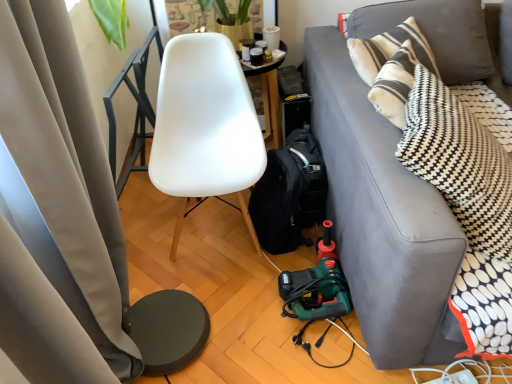
Question: Does black fabric backpack at lower center have a greater width compared to white plastic power outlet at lower right?

Choices:
 (A) no
 (B) yes

Answer: (B)

Question: From the image's perspective, is black fabric backpack at lower center above white plastic power outlet at lower right?

Choices:
 (A) yes
 (B) no

Answer: (A)

Question: Does black fabric backpack at lower center appear on the right side of white plastic power outlet at lower right?

Choices:
 (A) no
 (B) yes

Answer: (A)

Question: Is black fabric backpack at lower center far away from white plastic power outlet at lower right?

Choices:
 (A) yes
 (B) no

Answer: (B)

Question: Considering the relative sizes of black fabric backpack at lower center and white plastic power outlet at lower right in the image provided, is black fabric backpack at lower center shorter than white plastic power outlet at lower right?

Choices:
 (A) yes
 (B) no

Answer: (B)

Question: From a real-world perspective, is black fabric backpack at lower center on white plastic power outlet at lower right?

Choices:
 (A) yes
 (B) no

Answer: (A)

Question: Is the position of white plastic power outlet at lower right more distant than that of gray fabric couch at right?

Choices:
 (A) no
 (B) yes

Answer: (B)

Question: Is white plastic power outlet at lower right at the right side of gray fabric couch at right?

Choices:
 (A) no
 (B) yes

Answer: (A)

Question: Can you confirm if white plastic power outlet at lower right is smaller than gray fabric couch at right?

Choices:
 (A) yes
 (B) no

Answer: (A)

Question: Does white plastic power outlet at lower right have a lesser height compared to gray fabric couch at right?

Choices:
 (A) yes
 (B) no

Answer: (A)

Question: Is white plastic power outlet at lower right oriented away from gray fabric couch at right?

Choices:
 (A) yes
 (B) no

Answer: (B)

Question: Does white plastic power outlet at lower right turn towards gray fabric couch at right?

Choices:
 (A) no
 (B) yes

Answer: (A)

Question: Is gray fabric couch at right turned away from black fabric backpack at lower center?

Choices:
 (A) no
 (B) yes

Answer: (A)